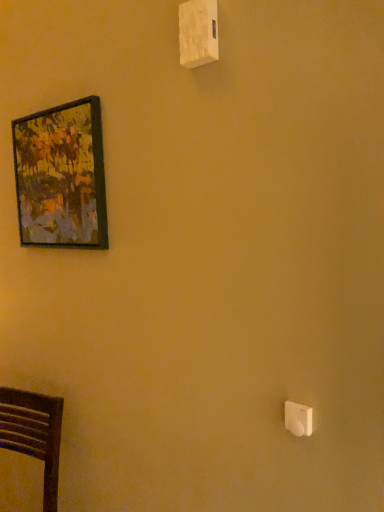
Question: From the image's perspective, is white plastic light switch at lower right, which is the second light switch in back-to-front order, below dark wood chair at lower left?

Choices:
 (A) yes
 (B) no

Answer: (B)

Question: Does white plastic light switch at lower right, marked as the first light switch in a front-to-back arrangement, have a greater height compared to dark wood chair at lower left?

Choices:
 (A) yes
 (B) no

Answer: (B)

Question: Considering the relative sizes of white plastic light switch at lower right, which is the second light switch in back-to-front order, and dark wood chair at lower left in the image provided, is white plastic light switch at lower right, which is the second light switch in back-to-front order, thinner than dark wood chair at lower left?

Choices:
 (A) no
 (B) yes

Answer: (B)

Question: Could you tell me if white plastic light switch at lower right, arranged as the first light switch when ordered from the bottom, is turned towards dark wood chair at lower left?

Choices:
 (A) yes
 (B) no

Answer: (B)

Question: Does white plastic light switch at lower right, arranged as the first light switch when ordered from the bottom, have a larger size compared to dark wood chair at lower left?

Choices:
 (A) yes
 (B) no

Answer: (B)

Question: Based on their sizes in the image, would you say white plastic light switch at lower right, positioned as the 2th light switch in top-to-bottom order, is bigger or smaller than white plastic light switch at upper center, placed as the second light switch when sorted from front to back?

Choices:
 (A) small
 (B) big

Answer: (A)

Question: Considering the positions of point (301, 403) and point (205, 41), is point (301, 403) closer or farther from the camera than point (205, 41)?

Choices:
 (A) closer
 (B) farther

Answer: (A)

Question: From the image's perspective, relative to white plastic light switch at upper center, which is the 1th light switch in back-to-front order, is white plastic light switch at lower right, the 1th light switch from the right, above or below?

Choices:
 (A) above
 (B) below

Answer: (B)

Question: From a real-world perspective, is white plastic light switch at lower right, which appears as the 2th light switch when viewed from the left, above or below white plastic light switch at upper center, the 1th light switch in the left-to-right sequence?

Choices:
 (A) below
 (B) above

Answer: (A)

Question: From a real-world perspective, is white plastic light switch at lower right, which is the second light switch in back-to-front order, positioned above or below dark wood chair at lower left?

Choices:
 (A) above
 (B) below

Answer: (A)

Question: Looking at the image, does white plastic light switch at lower right, the 1th light switch from the right, seem bigger or smaller compared to dark wood chair at lower left?

Choices:
 (A) big
 (B) small

Answer: (B)

Question: In the image, is white plastic light switch at lower right, positioned as the 2th light switch in top-to-bottom order, positioned in front of or behind dark wood chair at lower left?

Choices:
 (A) front
 (B) behind

Answer: (A)

Question: Is white plastic light switch at lower right, the 1th light switch from the right, to the left or to the right of dark wood chair at lower left in the image?

Choices:
 (A) right
 (B) left

Answer: (A)

Question: From the image's perspective, is wooden-framed painting at upper left located above or below dark wood chair at lower left?

Choices:
 (A) below
 (B) above

Answer: (B)

Question: From a real-world perspective, is wooden-framed painting at upper left positioned above or below dark wood chair at lower left?

Choices:
 (A) above
 (B) below

Answer: (A)